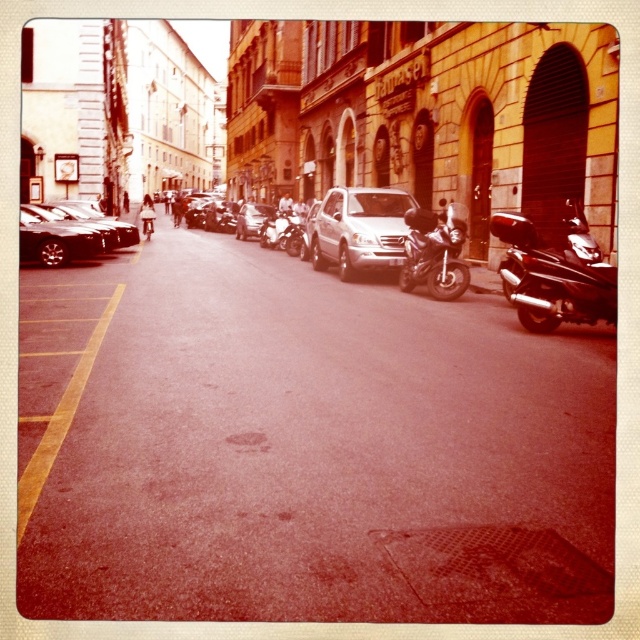
Does silver metallic van at center have a lesser width compared to shiny silver car at center?

Yes.

Between point (348, 278) and point (253, 212), which one is positioned behind?

Positioned behind is point (253, 212).

Which is in front, point (349, 240) or point (260, 204)?

Point (349, 240) is more forward.

This screenshot has width=640, height=640. What are the coordinates of `silver metallic van at center` in the screenshot? It's located at (358, 228).

Is point (320, 232) positioned in front of point (51, 211)?

Yes.

Locate an element on the screen. silver metallic van at center is located at coordinates (358, 228).

Can you confirm if black matte motorcycle at center-right is smaller than metallic silver scooter at center?

Indeed, black matte motorcycle at center-right has a smaller size compared to metallic silver scooter at center.

At what (x,y) coordinates should I click in order to perform the action: click on black matte motorcycle at center-right. Please return your answer as a coordinate pair (x, y). This screenshot has width=640, height=640. Looking at the image, I should click on (554, 275).

Is point (529, 237) positioned after point (280, 241)?

No, it is in front of (280, 241).

Locate an element on the screen. The width and height of the screenshot is (640, 640). black matte motorcycle at center-right is located at coordinates (554, 275).